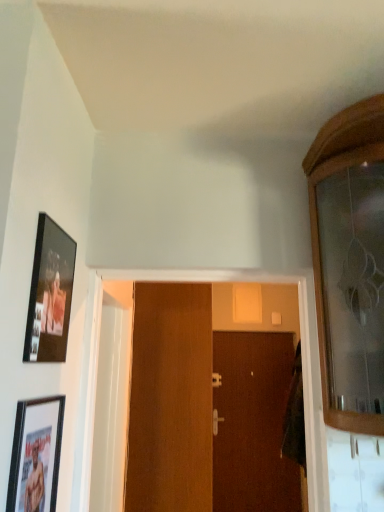
Question: Which direction should I rotate to face silver metallic door handle at center, arranged as the 1th door handle when viewed from the front, — up or down?

Choices:
 (A) up
 (B) down

Answer: (B)

Question: Does matte black picture frame at lower left, acting as the second picture frame starting from the top, have a lesser width compared to brown wooden door at center, which is the 2th door from front to back?

Choices:
 (A) no
 (B) yes

Answer: (B)

Question: Considering the relative sizes of matte black picture frame at lower left, which appears as the 1th picture frame when ordered from the bottom, and brown wooden door at center, which is the 2th door from front to back, in the image provided, is matte black picture frame at lower left, which appears as the 1th picture frame when ordered from the bottom, bigger than brown wooden door at center, which is the 2th door from front to back,?

Choices:
 (A) yes
 (B) no

Answer: (B)

Question: Is matte black picture frame at lower left, which appears as the 1th picture frame when ordered from the bottom, surrounding brown wooden door at center, which is counted as the 1th door, starting from the right?

Choices:
 (A) no
 (B) yes

Answer: (A)

Question: Does matte black picture frame at lower left, which appears as the 1th picture frame when ordered from the bottom, have a greater width compared to brown wooden door at center, positioned as the 1th door in back-to-front order?

Choices:
 (A) yes
 (B) no

Answer: (B)

Question: From a real-world perspective, is matte black picture frame at lower left, which appears as the 1th picture frame when ordered from the bottom, located beneath brown wooden door at center, which is counted as the 1th door, starting from the right?

Choices:
 (A) no
 (B) yes

Answer: (A)

Question: Considering the relative positions of matte black picture frame at lower left, which appears as the 1th picture frame when ordered from the bottom, and brown wooden door at center, which is the 2th door from front to back, in the image provided, is matte black picture frame at lower left, which appears as the 1th picture frame when ordered from the bottom, to the left of brown wooden door at center, which is the 2th door from front to back, from the viewer's perspective?

Choices:
 (A) no
 (B) yes

Answer: (B)

Question: Is matte black picture frame at upper left, which is the 1th picture frame in top-to-bottom order, wider than matte black picture frame at lower left, which appears as the 1th picture frame when ordered from the bottom?

Choices:
 (A) yes
 (B) no

Answer: (A)

Question: Is the position of matte black picture frame at upper left, which is the 1th picture frame in top-to-bottom order, more distant than that of matte black picture frame at lower left, acting as the second picture frame starting from the top?

Choices:
 (A) yes
 (B) no

Answer: (A)

Question: Is matte black picture frame at upper left, which is the 1th picture frame in top-to-bottom order, outside of matte black picture frame at lower left, acting as the second picture frame starting from the top?

Choices:
 (A) no
 (B) yes

Answer: (B)

Question: Is matte black picture frame at upper left, placed as the 2th picture frame when sorted from bottom to top, turned away from matte black picture frame at lower left, acting as the second picture frame starting from the top?

Choices:
 (A) yes
 (B) no

Answer: (B)

Question: Does matte black picture frame at upper left, placed as the 2th picture frame when sorted from bottom to top, come in front of matte black picture frame at lower left, acting as the second picture frame starting from the top?

Choices:
 (A) no
 (B) yes

Answer: (A)

Question: From the image's perspective, is matte black picture frame at upper left, placed as the 2th picture frame when sorted from bottom to top, below matte black picture frame at lower left, acting as the second picture frame starting from the top?

Choices:
 (A) no
 (B) yes

Answer: (A)

Question: Does brown wooden door at center, arranged as the 2th door when viewed from the left, lie in front of silver metallic door handle at center, the second door handle from the bottom?

Choices:
 (A) yes
 (B) no

Answer: (A)